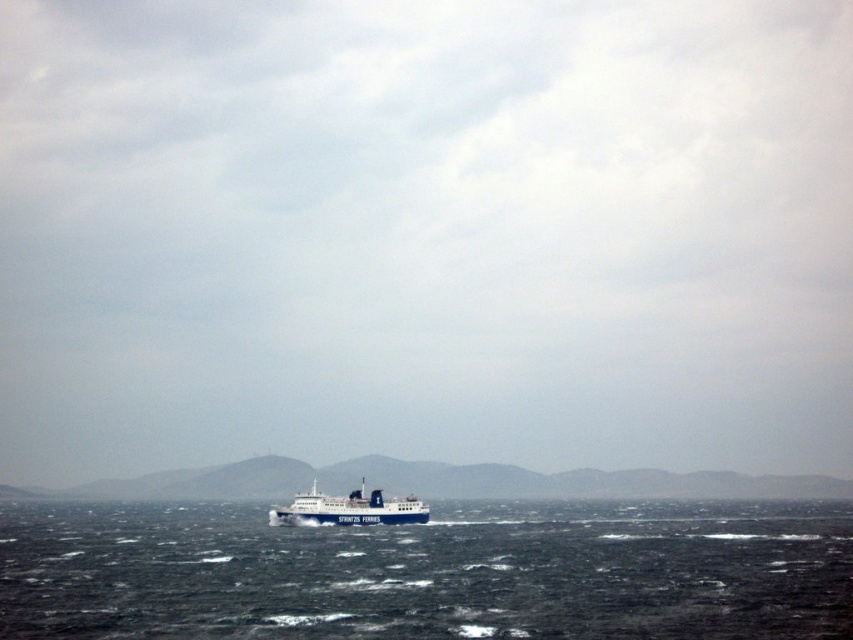
You are a sailor trying to navigate the STRINTZIS FERRIES ferry. You notice the white matte horizon at center and the blue matte ferry at center in your view. Which of these two has a greater width in the image?

The white matte horizon at center has a greater width than the blue matte ferry at center, as stated in the description.

You are a passenger on the ferry and want to know where the dark blue water at center is in relation to the blue matte ferry at center. Can you describe its position?

The dark blue water at center is located below the blue matte ferry at center.